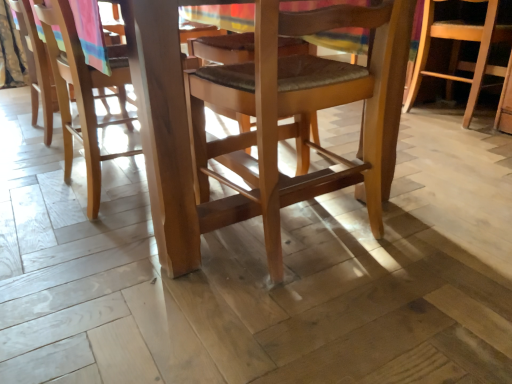
What do you see at coordinates (458, 54) in the screenshot? I see `wooden chair at center, the first chair viewed from the right` at bounding box center [458, 54].

Measure the distance between wooden chair at center, which is the 2th chair from left to right, and camera.

wooden chair at center, which is the 2th chair from left to right, and camera are 31.33 inches apart from each other.

The height and width of the screenshot is (384, 512). Describe the element at coordinates (301, 115) in the screenshot. I see `wooden chair at center, which is the 2th chair from left to right` at that location.

The image size is (512, 384). What do you see at coordinates (33, 60) in the screenshot?
I see `light brown wood chair at left, the 2th chair when ordered from front to back` at bounding box center [33, 60].

The width and height of the screenshot is (512, 384). In order to click on light brown wood chair at left, the 2th chair when ordered from front to back in this screenshot , I will do `click(33, 60)`.

Where is `wooden chair at center, which is counted as the 1th chair, starting from the back`? wooden chair at center, which is counted as the 1th chair, starting from the back is located at coordinates (458, 54).

Which object is closer to the camera taking this photo, wooden chair at center, positioned as the 3th chair in front-to-back order, or wooden chair at center, which is the 2th chair from left to right?

wooden chair at center, which is the 2th chair from left to right, is closer to the camera.

Could you tell me if wooden chair at center, which is counted as the 1th chair, starting from the back, is turned towards wooden chair at center, which is the 2th chair from left to right?

No, wooden chair at center, which is counted as the 1th chair, starting from the back, is not aimed at wooden chair at center, which is the 2th chair from left to right.

Are wooden chair at center, which is counted as the 1th chair, starting from the back, and wooden chair at center, the second chair from the right, located far from each other?

wooden chair at center, which is counted as the 1th chair, starting from the back, is actually quite close to wooden chair at center, the second chair from the right.

How different are the orientations of light brown wood chair at left, the 2th chair when ordered from front to back, and wooden chair at center, positioned as the 3th chair in front-to-back order, in degrees?

The angle between the facing direction of light brown wood chair at left, the 2th chair when ordered from front to back, and the facing direction of wooden chair at center, positioned as the 3th chair in front-to-back order, is 0.403 degrees.

From a real-world perspective, which object rests below the other?

From a 3D spatial view, wooden chair at center, the first chair viewed from the right, is below.

From the image's perspective, does light brown wood chair at left, placed as the 1th chair when sorted from left to right, appear lower than wooden chair at center, the first chair viewed from the right?

Yes, from the image's perspective, light brown wood chair at left, placed as the 1th chair when sorted from left to right, is below wooden chair at center, the first chair viewed from the right.

Which object is positioned more to the left, wooden chair at center, positioned as the 3th chair in left-to-right order, or light brown wood chair at left, the 3th chair positioned from the right?

light brown wood chair at left, the 3th chair positioned from the right, is more to the left.

From a real-world perspective, is wooden chair at center, the first chair viewed from the right, on top of light brown wood chair at left, the 3th chair positioned from the right?

No, from a real-world perspective, wooden chair at center, the first chair viewed from the right, is not over light brown wood chair at left, the 3th chair positioned from the right

Does wooden chair at center, positioned as the 3th chair in front-to-back order, come behind light brown wood chair at left, placed as the 1th chair when sorted from left to right?

Yes.

Based on the photo, which is farther from the camera, (288, 59) or (35, 62)?

The point (35, 62) is behind.

How far apart are wooden chair at center, the 3th chair from the back, and light brown wood chair at left, placed as the 1th chair when sorted from left to right?

The distance of wooden chair at center, the 3th chair from the back, from light brown wood chair at left, placed as the 1th chair when sorted from left to right, is 1.07 meters.

From the image's perspective, is wooden chair at center, which is the 2th chair from left to right, located above or below light brown wood chair at left, placed as the 1th chair when sorted from left to right?

Clearly, from the image's perspective, wooden chair at center, which is the 2th chair from left to right, is below light brown wood chair at left, placed as the 1th chair when sorted from left to right.

Who is bigger, wooden chair at center, the second chair from the right, or light brown wood chair at left, the second chair positioned from the back?

With larger size is wooden chair at center, the second chair from the right.

Would you consider wooden chair at center, the 3th chair from the back, to be distant from wooden chair at center, the first chair viewed from the right?

They are positioned close to each other.

Could you tell me if wooden chair at center, which appears as the first chair when viewed from the front, is turned towards wooden chair at center, positioned as the 3th chair in front-to-back order?

No, wooden chair at center, which appears as the first chair when viewed from the front, is not facing towards wooden chair at center, positioned as the 3th chair in front-to-back order.

Consider the image. Is wooden chair at center, the second chair from the right, bigger than wooden chair at center, which is counted as the 1th chair, starting from the back?

Yes.

From a real-world perspective, which is physically below, wooden chair at center, the second chair from the right, or wooden chair at center, the first chair viewed from the right?

→ wooden chair at center, the first chair viewed from the right, from a real-world perspective.

From a real-world perspective, is light brown wood chair at left, the second chair positioned from the back, on wooden chair at center, the second chair from the right?

Yes, from a real-world perspective, light brown wood chair at left, the second chair positioned from the back, is on top of wooden chair at center, the second chair from the right.

From the image's perspective, who appears lower, light brown wood chair at left, the second chair positioned from the back, or wooden chair at center, the second chair from the right?

wooden chair at center, the second chair from the right, appears lower in the image.

Is light brown wood chair at left, the second chair positioned from the back, positioned far away from wooden chair at center, the 3th chair from the back?

Yes, light brown wood chair at left, the second chair positioned from the back, and wooden chair at center, the 3th chair from the back, are quite far apart.

Is light brown wood chair at left, placed as the 1th chair when sorted from left to right, aimed at wooden chair at center, the second chair from the right?

No, light brown wood chair at left, placed as the 1th chair when sorted from left to right, is not oriented towards wooden chair at center, the second chair from the right.

The height and width of the screenshot is (384, 512). I want to click on chair that is the 1st object above the wooden chair at center, positioned as the 3th chair in left-to-right order (from a real-world perspective), so click(x=301, y=115).

You are a GUI agent. You are given a task and a screenshot of the screen. Output one action in this format:
    pyautogui.click(x=<x>, y=<y>)
    Task: Click on the chair that is the 1st object located in front of the wooden chair at center, the first chair viewed from the right
    The image size is (512, 384).
    Given the screenshot: What is the action you would take?
    pyautogui.click(x=33, y=60)

When comparing their distances from wooden chair at center, which is counted as the 1th chair, starting from the back, does light brown wood chair at left, placed as the 1th chair when sorted from left to right, or wooden chair at center, the 3th chair from the back, seem further?

light brown wood chair at left, placed as the 1th chair when sorted from left to right, is positioned further to the anchor wooden chair at center, which is counted as the 1th chair, starting from the back.

Estimate the real-world distances between objects in this image. Which object is closer to wooden chair at center, which is counted as the 1th chair, starting from the back, wooden chair at center, the second chair from the right, or light brown wood chair at left, the 2th chair when ordered from front to back?

wooden chair at center, the second chair from the right, is closer to wooden chair at center, which is counted as the 1th chair, starting from the back.

Considering their positions, is wooden chair at center, the first chair viewed from the right, positioned further to wooden chair at center, the 3th chair from the back, than light brown wood chair at left, the 2th chair when ordered from front to back?

light brown wood chair at left, the 2th chair when ordered from front to back, is further to wooden chair at center, the 3th chair from the back.

Considering their positions, is wooden chair at center, which is counted as the 1th chair, starting from the back, positioned further to light brown wood chair at left, the 3th chair positioned from the right, than wooden chair at center, which appears as the first chair when viewed from the front?

Based on the image, wooden chair at center, which is counted as the 1th chair, starting from the back, appears to be further to light brown wood chair at left, the 3th chair positioned from the right.

From the image, which object appears to be farther from light brown wood chair at left, the 3th chair positioned from the right, wooden chair at center, which appears as the first chair when viewed from the front, or wooden chair at center, the first chair viewed from the right?

Among the two, wooden chair at center, the first chair viewed from the right, is located further to light brown wood chair at left, the 3th chair positioned from the right.

Based on their spatial positions, is light brown wood chair at left, the 2th chair when ordered from front to back, or wooden chair at center, positioned as the 3th chair in front-to-back order, closer to wooden chair at center, which appears as the first chair when viewed from the front?

wooden chair at center, positioned as the 3th chair in front-to-back order.

What are the coordinates of `chair between light brown wood chair at left, the 3th chair positioned from the right, and wooden chair at center, positioned as the 3th chair in front-to-back order` in the screenshot? It's located at (301, 115).